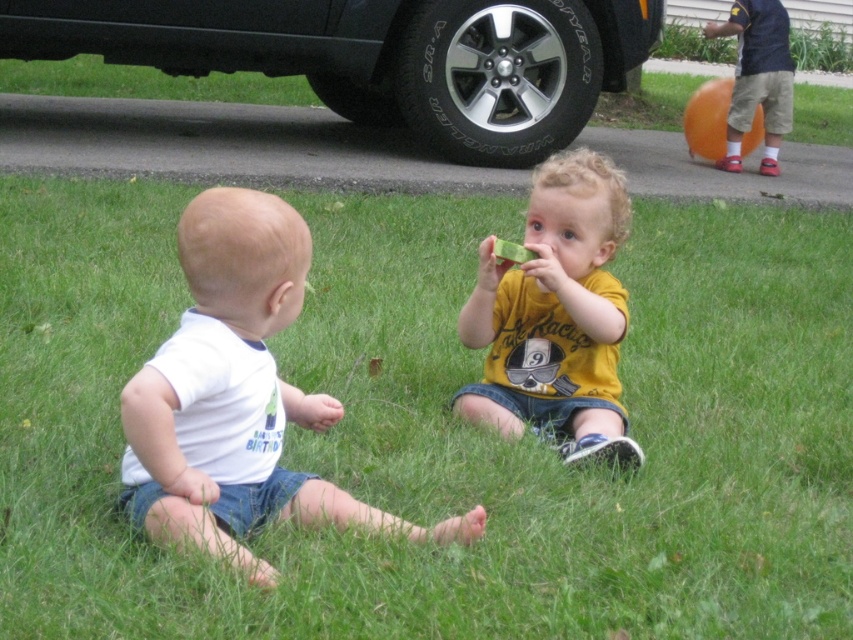
Does green grass at center have a lesser height compared to black rubber tire at upper center?

Yes.

Between point (77, 410) and point (399, 83), which one is positioned behind?

Point (399, 83)

This screenshot has width=853, height=640. I want to click on green grass at center, so click(442, 429).

Is black rubber tire at upper center smaller than dark blue shirt at upper right?

Incorrect, black rubber tire at upper center is not smaller in size than dark blue shirt at upper right.

Does point (567, 131) lie behind point (752, 44)?

No, (567, 131) is in front of (752, 44).

Which is behind, point (357, 44) or point (761, 84)?

Point (761, 84)

Locate an element on the screen. Image resolution: width=853 pixels, height=640 pixels. black rubber tire at upper center is located at coordinates [x=378, y=58].

Consider the image. Does black rubber tire at center have a lesser width compared to dark blue shirt at upper right?

Incorrect, black rubber tire at center's width is not less than dark blue shirt at upper right's.

Which is more to the right, black rubber tire at center or dark blue shirt at upper right?

Positioned to the right is dark blue shirt at upper right.

Who is more distant from viewer, (419, 32) or (724, 33)?

Point (724, 33)

Locate an element on the screen. black rubber tire at center is located at coordinates (498, 77).